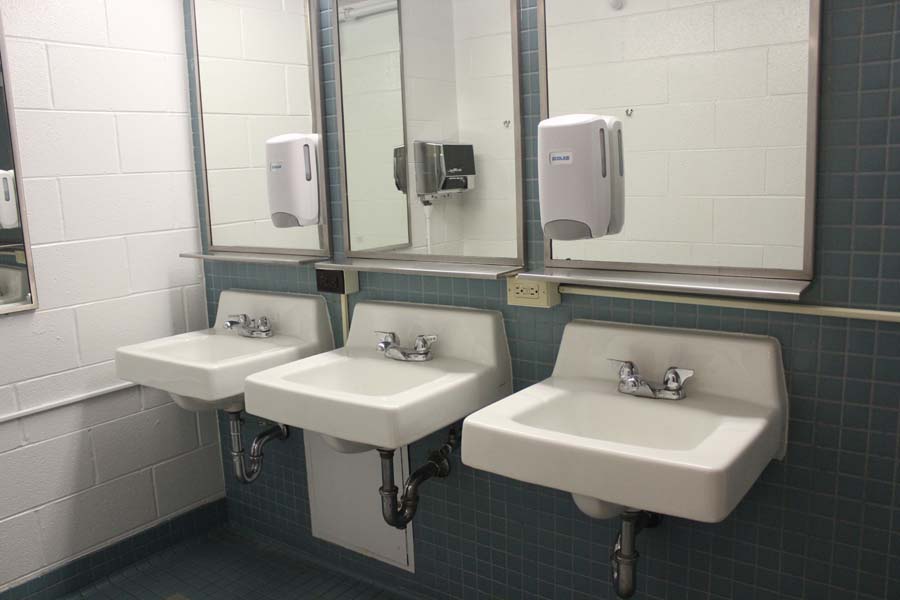
Identify the location of cover of electrical supply. (343, 315), (850, 314), (79, 399).